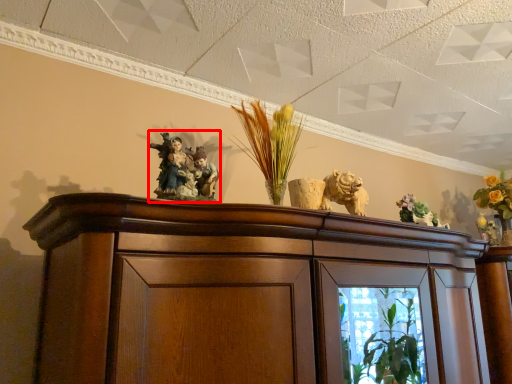
Question: From the image's perspective, where is collection (annotated by the red box) located relative to floral arrangement?

Choices:
 (A) below
 (B) above

Answer: (B)